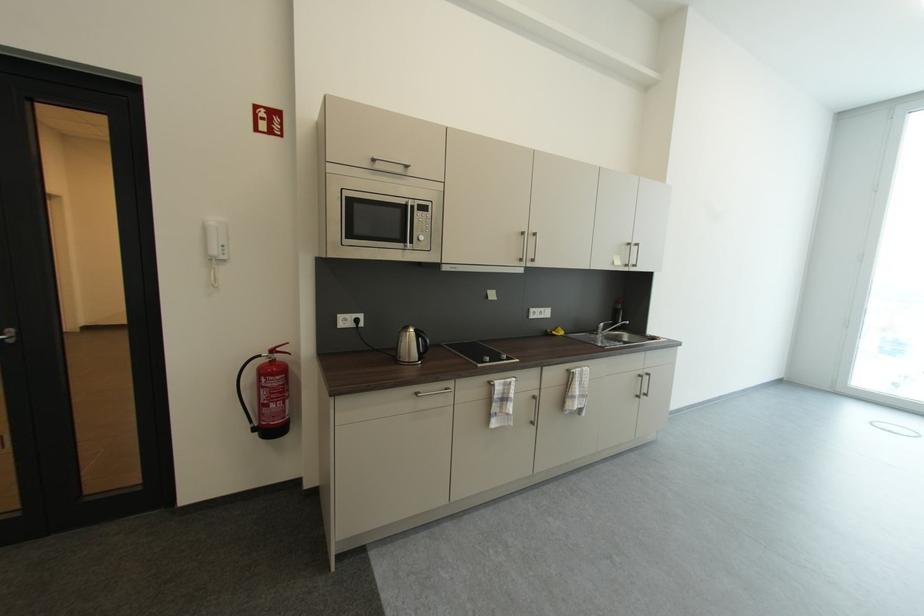
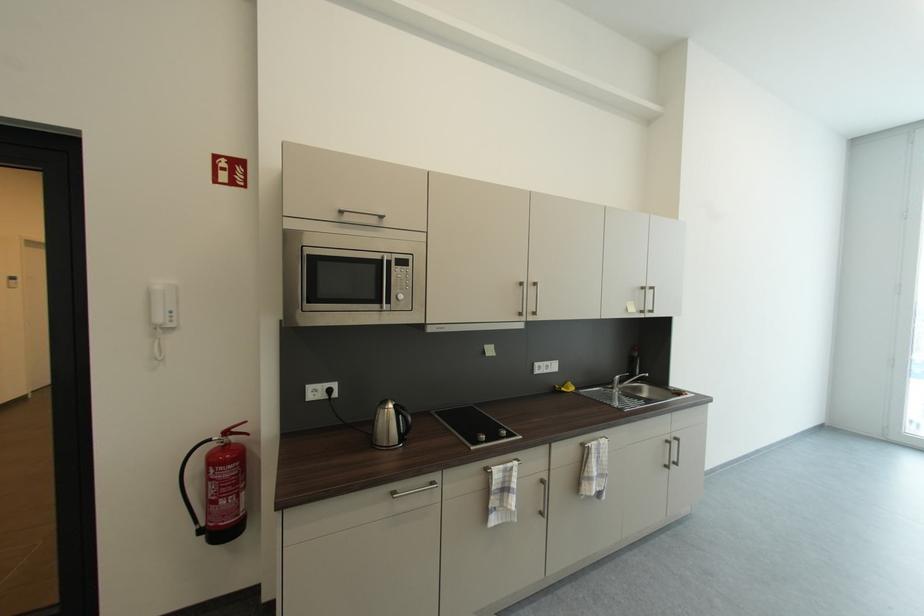
The point at [421,331] is marked in the first image. Where is the corresponding point in the second image?

(400, 407)